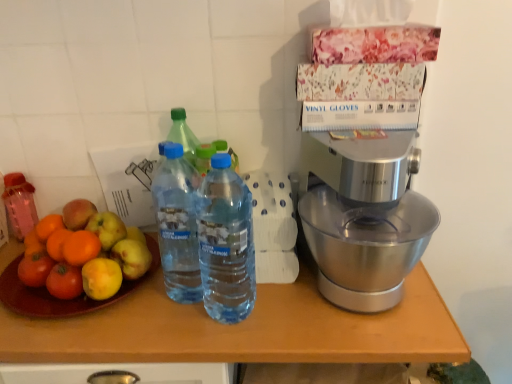
Locate an element on the screen. This screenshot has height=384, width=512. free space in front of blue plastic bottle at center, positioned as the second bottle in left-to-right order is located at coordinates (180, 334).